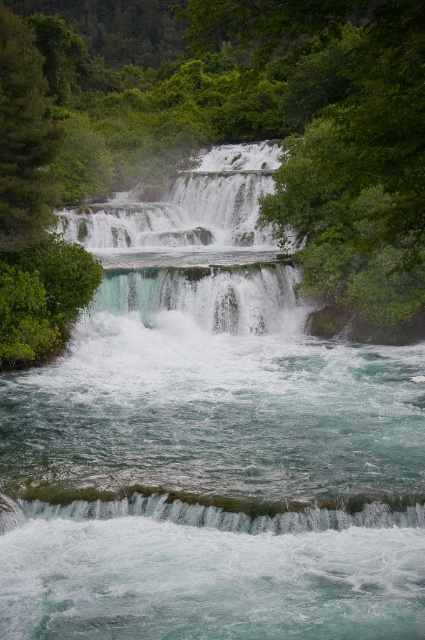
You are standing at the base of the waterfall and notice two points marked in the scene. One is at coordinates point (34, 61) and the other is at point (91, 243). Which point is closer to your current position?

Point (34, 61) is closer to the camera than point (91, 243), so the point at coordinates point (34, 61) is closer to your current position.